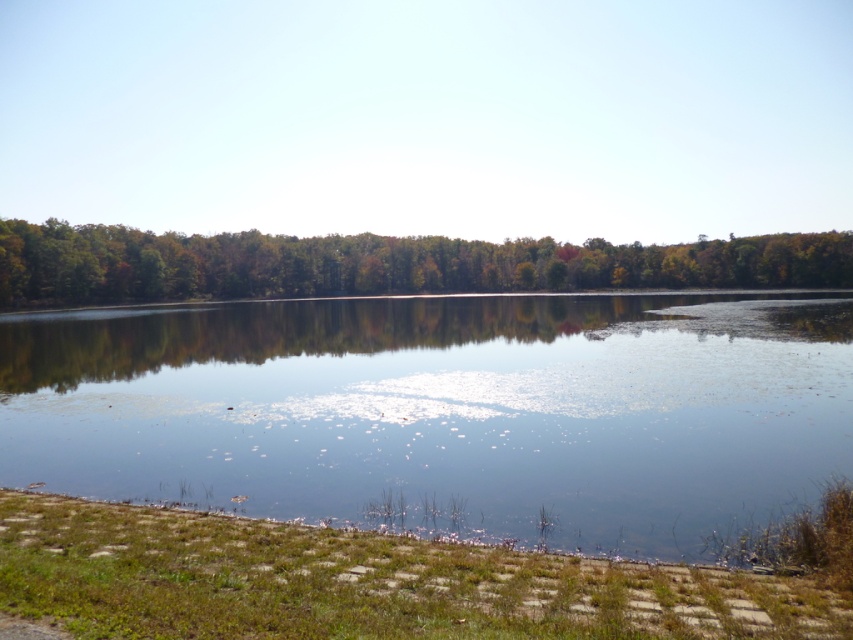
Question: Does clear water at center have a smaller size compared to green matte trees at upper center?

Choices:
 (A) yes
 (B) no

Answer: (A)

Question: Is clear water at center below green matte trees at upper center?

Choices:
 (A) no
 (B) yes

Answer: (B)

Question: Is clear water at center below green matte trees at upper center?

Choices:
 (A) no
 (B) yes

Answer: (B)

Question: Among these points, which one is nearest to the camera?

Choices:
 (A) (695, 506)
 (B) (589, 284)

Answer: (A)